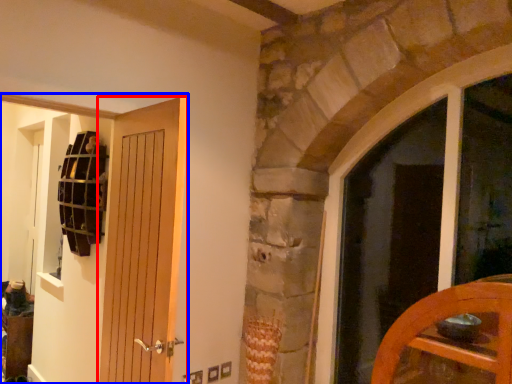
Question: Which object appears farthest to the camera in this image, door (highlighted by a red box) or door (highlighted by a blue box)?

Choices:
 (A) door
 (B) door

Answer: (B)